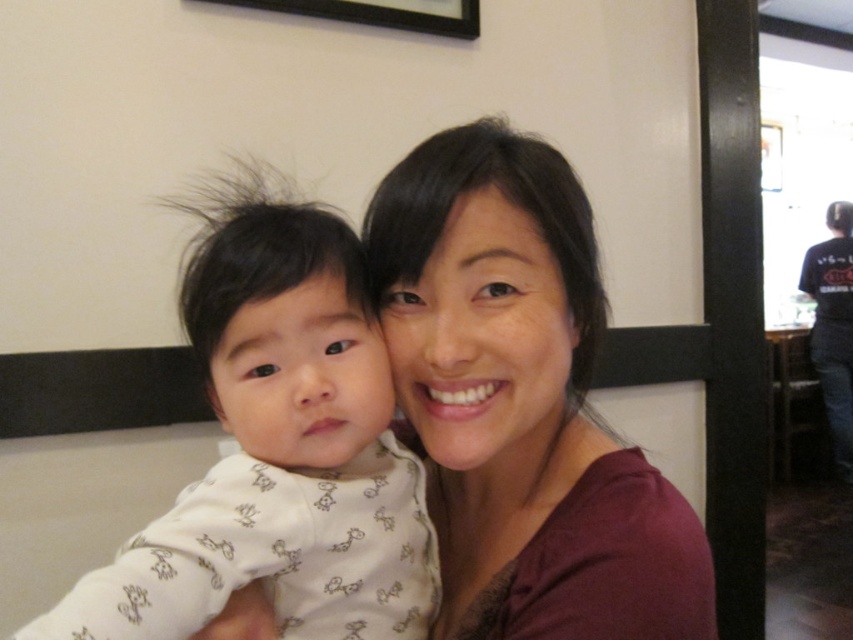
Question: Can you confirm if matte maroon shirt at center is smaller than black matte picture frame at upper center?

Choices:
 (A) yes
 (B) no

Answer: (B)

Question: Among these points, which one is nearest to the camera?

Choices:
 (A) tap(846, 291)
 (B) tap(340, 19)
 (C) tap(357, 292)

Answer: (C)

Question: Does matte maroon shirt at center come in front of black t-shirt at right?

Choices:
 (A) no
 (B) yes

Answer: (B)

Question: Which point is farther to the camera?

Choices:
 (A) matte maroon shirt at center
 (B) white soft fabric baby at left

Answer: (A)

Question: Which of these objects is positioned farthest from the white soft fabric baby at left?

Choices:
 (A) black matte picture frame at upper center
 (B) black t-shirt at right

Answer: (B)

Question: Is matte maroon shirt at center further to the viewer compared to black t-shirt at right?

Choices:
 (A) no
 (B) yes

Answer: (A)